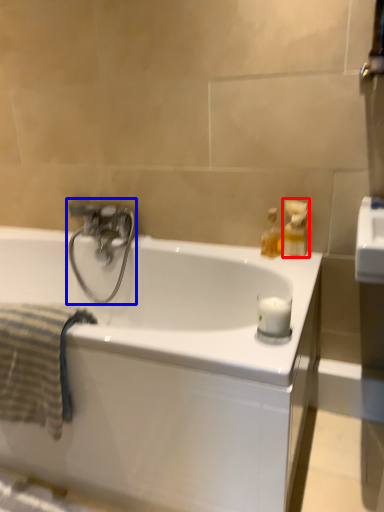
Question: Which object is closer to the camera taking this photo, soap dispenser (highlighted by a red box) or tap (highlighted by a blue box)?

Choices:
 (A) soap dispenser
 (B) tap

Answer: (A)